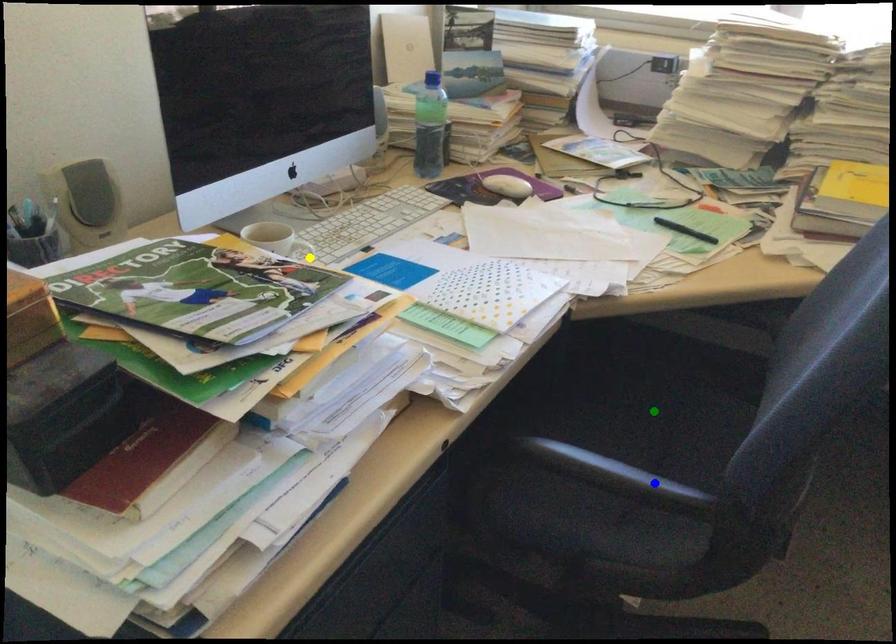
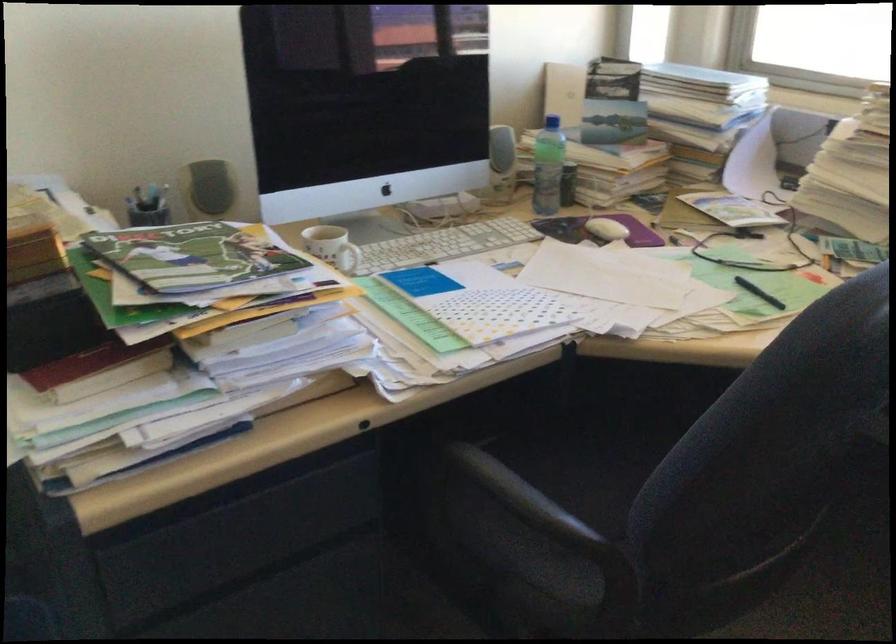
I am providing you with two images of the same scene from different viewpoints. Three points are marked in image1. Which point corresponds to a part or object that is occluded in image2?In image1, three points are marked. Which of them correspond to a part or object that is occluded in image2?Among the three points shown in image1, which one corresponds to a part or object that is no longer visible due to occlusion in image2?

Invisible in image2: green point.